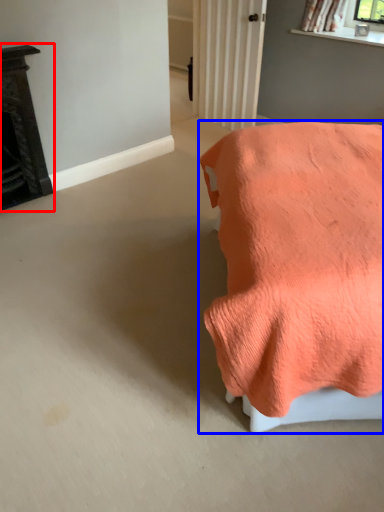
Question: Among these objects, which one is farthest to the camera, furniture (highlighted by a red box) or furniture (highlighted by a blue box)?

Choices:
 (A) furniture
 (B) furniture

Answer: (A)